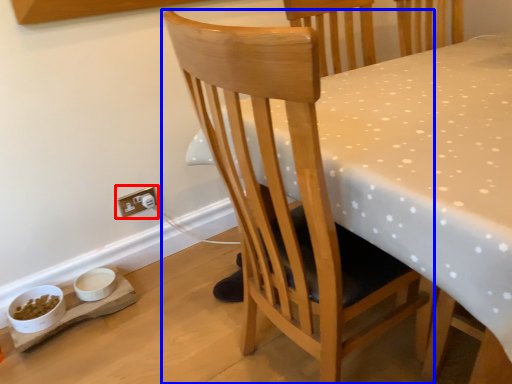
Question: Which of the following is the farthest to the observer, electric outlet (highlighted by a red box) or chair (highlighted by a blue box)?

Choices:
 (A) electric outlet
 (B) chair

Answer: (A)